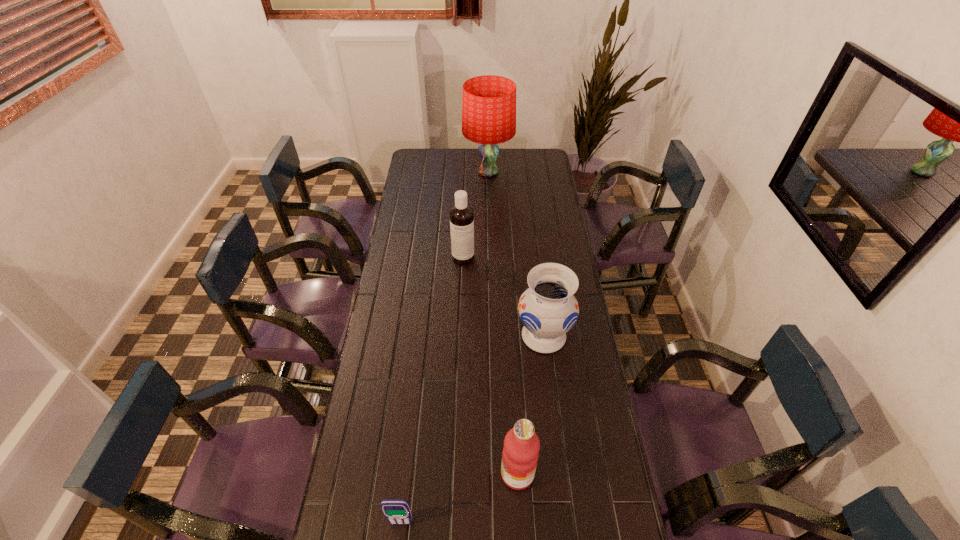
This screenshot has width=960, height=540. Identify the location of free point between the fourth nearest object and the tallest object. (476, 215).

What are the coordinates of `vacant space that is in between the nearest object and the third nearest object` in the screenshot? It's located at (472, 429).

Locate an element on the screen. vacant space in between the third nearest object and the second nearest object is located at coordinates (531, 405).

This screenshot has width=960, height=540. I want to click on vacant point located between the fruit juice and the cellular telephone, so click(x=459, y=498).

Identify the location of vacant region between the shortest object and the dishwasher detergent. (432, 390).

Locate an element on the screen. vacant space in between the lampshade and the cellular telephone is located at coordinates (444, 348).

At what (x,y) coordinates should I click in order to perform the action: click on vacant area between the cellular telephone and the fourth nearest object. Please return your answer as a coordinate pair (x, y). This screenshot has width=960, height=540. Looking at the image, I should click on (432, 390).

I want to click on unoccupied area between the lampshade and the leftmost object, so click(444, 348).

You are a GUI agent. You are given a task and a screenshot of the screen. Output one action in this format:
    pyautogui.click(x=<x>, y=<y>)
    Task: Click on the empty space that is in between the leftmost object and the second farthest object
    This screenshot has width=960, height=540.
    Given the screenshot: What is the action you would take?
    pyautogui.click(x=432, y=390)

Identify the location of empty location between the fourth nearest object and the tallest object. This screenshot has width=960, height=540. (476, 215).